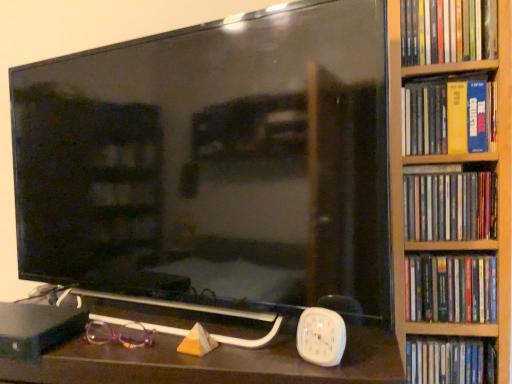
Question: From a real-world perspective, is purple plastic glasses at lower left over white plastic clock at lower right?

Choices:
 (A) yes
 (B) no

Answer: (B)

Question: Is purple plastic glasses at lower left positioned with its back to white plastic clock at lower right?

Choices:
 (A) no
 (B) yes

Answer: (A)

Question: Is the depth of purple plastic glasses at lower left greater than that of white plastic clock at lower right?

Choices:
 (A) yes
 (B) no

Answer: (A)

Question: Considering the relative sizes of purple plastic glasses at lower left and white plastic clock at lower right in the image provided, is purple plastic glasses at lower left taller than white plastic clock at lower right?

Choices:
 (A) no
 (B) yes

Answer: (A)

Question: From a real-world perspective, is purple plastic glasses at lower left physically below white plastic clock at lower right?

Choices:
 (A) yes
 (B) no

Answer: (A)

Question: From the image's perspective, is purple plastic glasses at lower left over white plastic clock at lower right?

Choices:
 (A) no
 (B) yes

Answer: (A)

Question: From the image's perspective, is hardcover book at right, the fourth book when ordered from top to bottom, below white plastic clock at lower right?

Choices:
 (A) yes
 (B) no

Answer: (B)

Question: From the image's perspective, does hardcover book at right, marked as the second book in a bottom-to-top arrangement, appear higher than white plastic clock at lower right?

Choices:
 (A) no
 (B) yes

Answer: (B)

Question: From a real-world perspective, is hardcover book at right, marked as the second book in a bottom-to-top arrangement, located beneath white plastic clock at lower right?

Choices:
 (A) yes
 (B) no

Answer: (B)

Question: Is hardcover book at right, the fourth book when ordered from top to bottom, bigger than white plastic clock at lower right?

Choices:
 (A) yes
 (B) no

Answer: (A)

Question: Is hardcover book at right, the fourth book when ordered from top to bottom, positioned behind white plastic clock at lower right?

Choices:
 (A) yes
 (B) no

Answer: (A)

Question: Considering the relative sizes of hardcover book at right, the fourth book when ordered from top to bottom, and white plastic clock at lower right in the image provided, is hardcover book at right, the fourth book when ordered from top to bottom, thinner than white plastic clock at lower right?

Choices:
 (A) yes
 (B) no

Answer: (B)

Question: Is white plastic clock at lower right far away from black glossy tv at center?

Choices:
 (A) yes
 (B) no

Answer: (B)